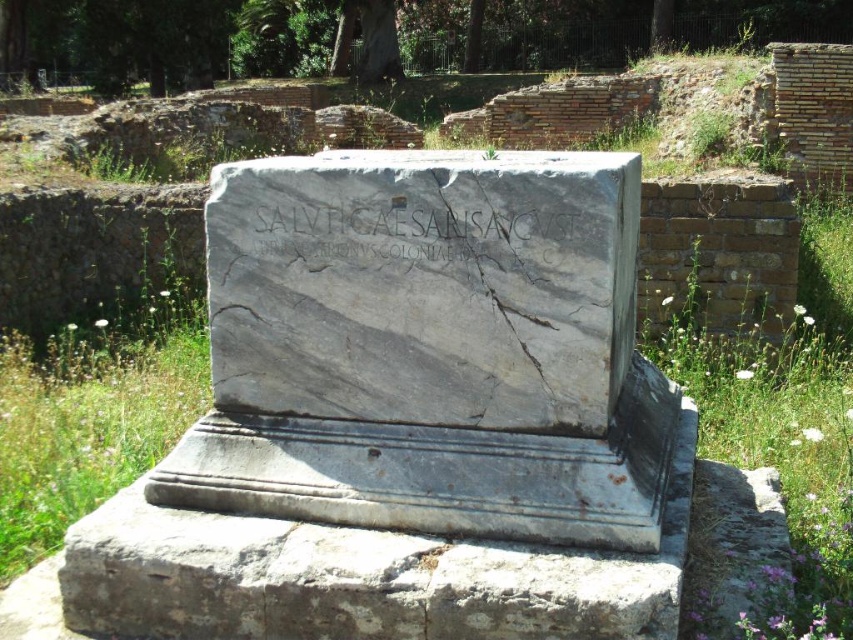
Question: Can you confirm if gray marble stone at center is positioned below gray marble inscription at center?

Choices:
 (A) yes
 (B) no

Answer: (A)

Question: Which point is closer to the camera taking this photo?

Choices:
 (A) click(611, 307)
 (B) click(465, 209)

Answer: (A)

Question: Is gray marble stone at center below gray marble inscription at center?

Choices:
 (A) no
 (B) yes

Answer: (B)

Question: Which point is closer to the camera?

Choices:
 (A) gray marble stone at center
 (B) gray marble inscription at center

Answer: (A)

Question: Which object is closer to the camera taking this photo?

Choices:
 (A) gray marble stone at center
 (B) gray marble inscription at center

Answer: (A)

Question: Is gray marble stone at center bigger than gray marble inscription at center?

Choices:
 (A) no
 (B) yes

Answer: (B)